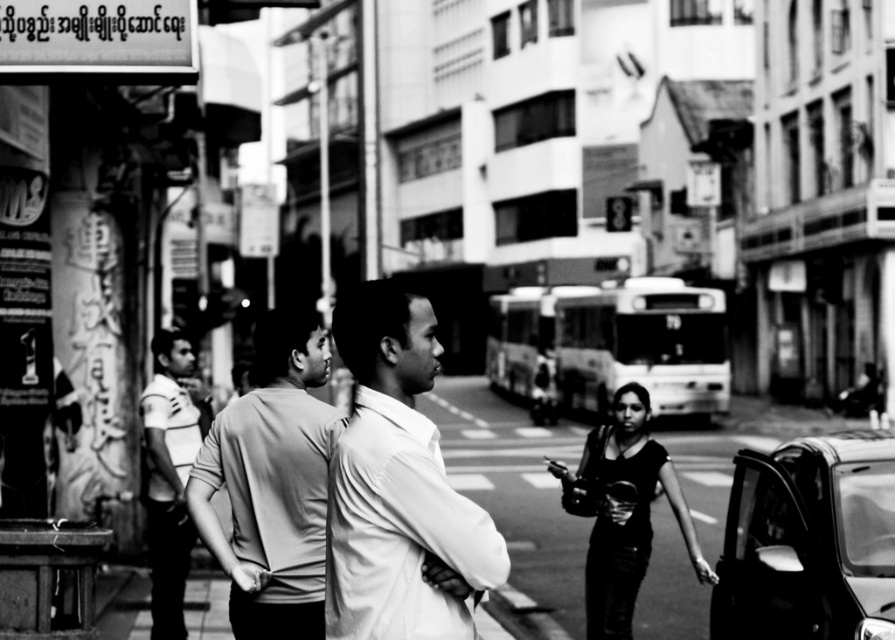
Does point (374, 598) come behind point (591, 554)?

No.

Which is in front, point (380, 509) or point (638, 532)?

Point (380, 509)

Locate an element on the screen. This screenshot has width=895, height=640. white smooth shirt at center is located at coordinates (398, 486).

I want to click on matte black dress at center, so click(629, 513).

Does matte black dress at center appear on the right side of striped jersey at left?

Indeed, matte black dress at center is positioned on the right side of striped jersey at left.

This screenshot has width=895, height=640. In order to click on matte black dress at center in this screenshot , I will do `click(629, 513)`.

Find the location of a particular element. matte black dress at center is located at coordinates (629, 513).

Between metallic car door at lower right and smooth gray t-shirt at center, which one appears on the right side from the viewer's perspective?

From the viewer's perspective, metallic car door at lower right appears more on the right side.

From the picture: Does metallic car door at lower right have a lesser width compared to smooth gray t-shirt at center?

Yes.

Locate an element on the screen. This screenshot has width=895, height=640. metallic car door at lower right is located at coordinates (808, 541).